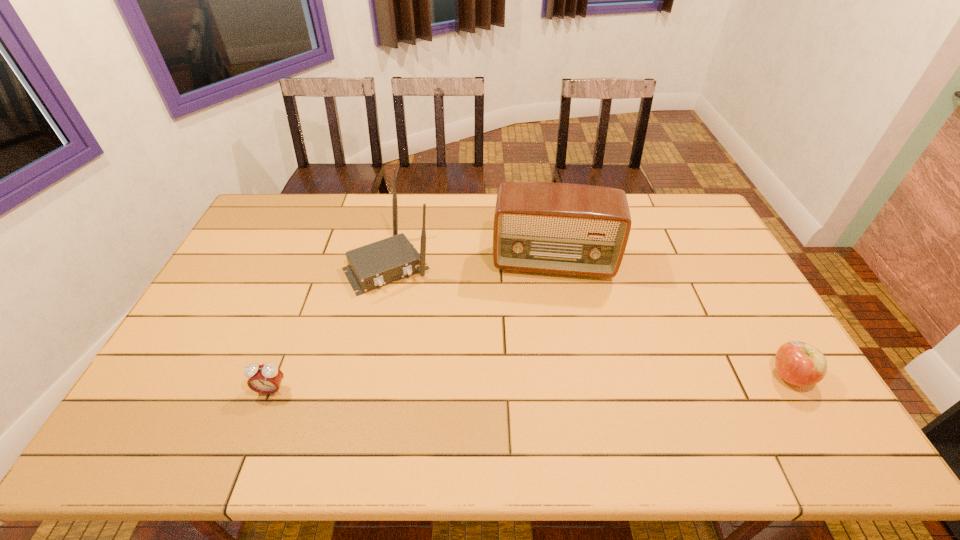
Locate an element on the screen. The image size is (960, 540). free space at the near right corner of the desktop is located at coordinates (813, 404).

At what (x,y) coordinates should I click in order to perform the action: click on free space between the apple and the router. Please return your answer as a coordinate pair (x, y). Looking at the image, I should click on (589, 321).

Locate an element on the screen. Image resolution: width=960 pixels, height=540 pixels. free space that is in between the radio receiver and the rightmost object is located at coordinates (672, 320).

At what (x,y) coordinates should I click in order to perform the action: click on free spot between the second object from right to left and the rightmost object. Please return your answer as a coordinate pair (x, y). The height and width of the screenshot is (540, 960). Looking at the image, I should click on (x=672, y=320).

Where is `vacant space that is in between the radio receiver and the second object from left to right`? This screenshot has width=960, height=540. vacant space that is in between the radio receiver and the second object from left to right is located at coordinates (471, 264).

Locate an element on the screen. Image resolution: width=960 pixels, height=540 pixels. empty space between the leftmost object and the rightmost object is located at coordinates pyautogui.click(x=531, y=383).

Locate an element on the screen. This screenshot has height=540, width=960. vacant space that is in between the router and the rightmost object is located at coordinates (589, 321).

The width and height of the screenshot is (960, 540). Identify the location of unoccupied position between the leftmost object and the router. (330, 328).

You are a GUI agent. You are given a task and a screenshot of the screen. Output one action in this format:
    pyautogui.click(x=<x>, y=<y>)
    Task: Click on the vacant space that's between the radio receiver and the apple
    This screenshot has height=540, width=960.
    Given the screenshot: What is the action you would take?
    pyautogui.click(x=672, y=320)

At what (x,y) coordinates should I click in order to perform the action: click on vacant space in between the third object from left to right and the router. Please return your answer as a coordinate pair (x, y). The width and height of the screenshot is (960, 540). Looking at the image, I should click on (471, 264).